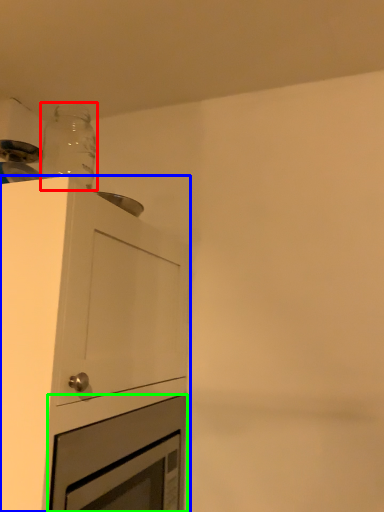
Question: Which is nearer to the bottle (highlighted by a red box)? cabinetry (highlighted by a blue box) or oven (highlighted by a green box).

Choices:
 (A) cabinetry
 (B) oven

Answer: (A)